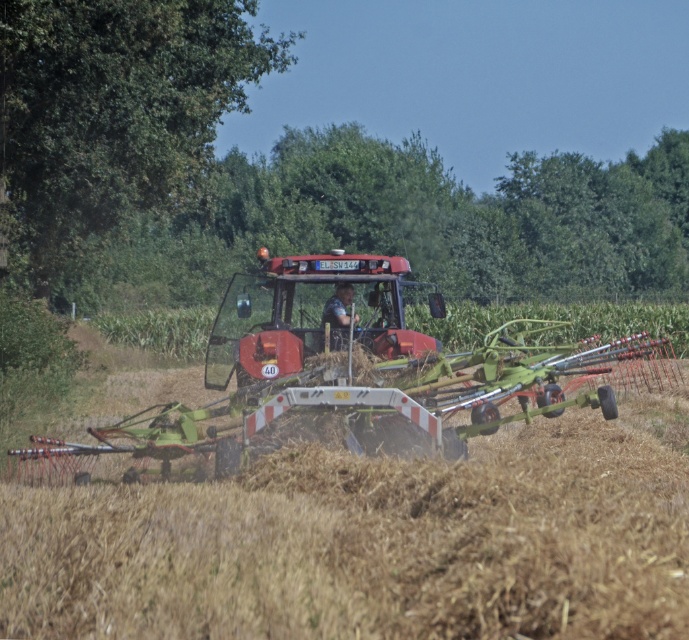
Is brown grassy field at center thinner than matte red tractor at center?

In fact, brown grassy field at center might be wider than matte red tractor at center.

This screenshot has width=689, height=640. Identify the location of brown grassy field at center. (373, 541).

Where is `brown grassy field at center`? Image resolution: width=689 pixels, height=640 pixels. brown grassy field at center is located at coordinates (373, 541).